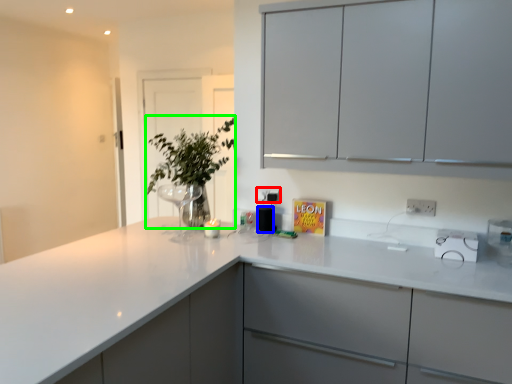
Question: Which object is positioned closest to electric outlet (highlighted by a red box)? Select from appliance (highlighted by a blue box) and plant (highlighted by a green box).

Choices:
 (A) appliance
 (B) plant

Answer: (A)